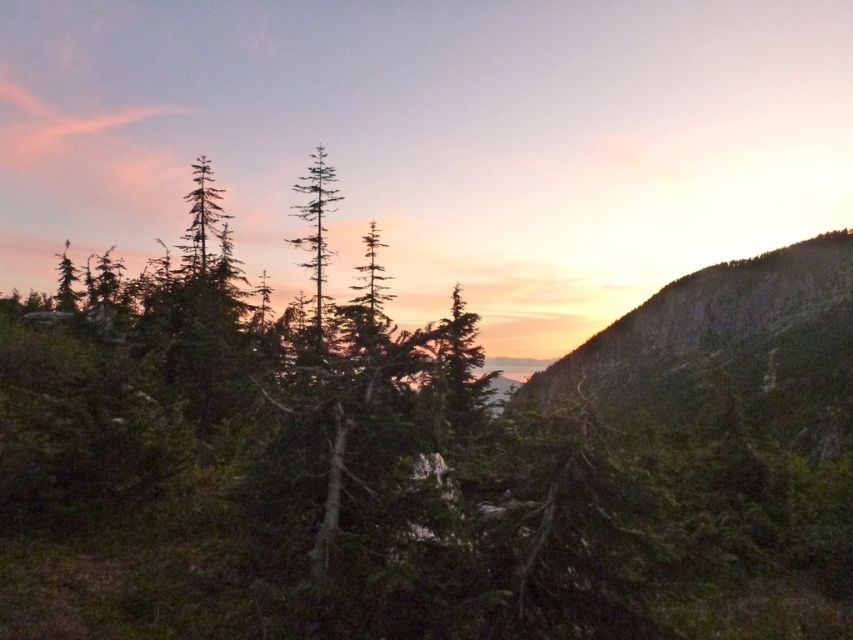
Is point (830, 372) closer to camera compared to point (311, 252)?

No, (830, 372) is behind (311, 252).

Between green textured rock at right and green matte tree at center, which one is positioned lower?

green textured rock at right is lower down.

At what (x,y) coordinates should I click in order to perform the action: click on green textured rock at right. Please return your answer as a coordinate pair (x, y). Looking at the image, I should click on (727, 349).